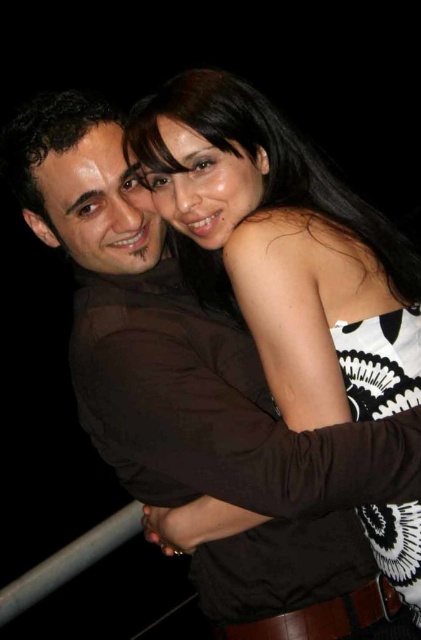
You are a photographer adjusting the focus on your camera. You have two points in the image you need to focus on, point (375, 360) and point (79, 128). Which point is closer to the camera and should be in focus first?

Point (375, 360) is further to the viewer than point (79, 128), so point (79, 128) is closer to the camera and should be in focus first.

You are a photographer trying to capture the black and white printed dress at center and the dark brown hair at left in a new shot. Which object should you focus on first if you want to ensure both are in focus, considering their sizes?

The black and white printed dress at center has a larger size compared to dark brown hair at left, so you should focus on the black and white printed dress at center first to ensure both are in focus.

You are a photographer standing at a distance of 1.2 meters from the black and white printed dress at center. Can you capture the entire dress in your camera frame without moving closer?

The black and white printed dress at center and viewer are 1.10 meters apart. Since you are standing 1.2 meters away, you are slightly farther than the 1.10 meter distance. Depending on your camera lens, you might need to adjust the zoom to ensure the entire dress fits in the frame without moving closer.